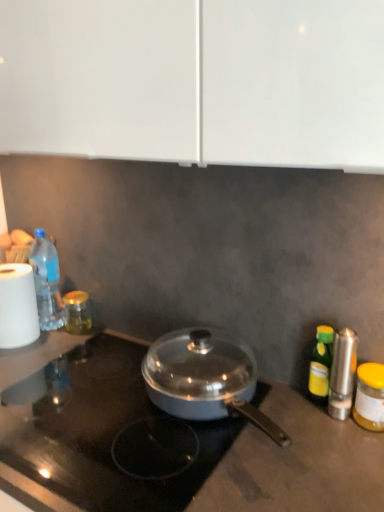
Question: Can you confirm if silver metallic salt shaker at right is taller than green glass bottle at right, which is the 2th bottle in front-to-back order?

Choices:
 (A) yes
 (B) no

Answer: (A)

Question: Is green glass bottle at right, the third bottle from the left, at the back of silver metallic salt shaker at right?

Choices:
 (A) no
 (B) yes

Answer: (A)

Question: Is silver metallic salt shaker at right aimed at green glass bottle at right, the 3th bottle positioned from the back?

Choices:
 (A) yes
 (B) no

Answer: (B)

Question: Is silver metallic salt shaker at right beside green glass bottle at right, marked as the second bottle in a right-to-left arrangement?

Choices:
 (A) yes
 (B) no

Answer: (A)

Question: Considering the relative positions of silver metallic salt shaker at right and green glass bottle at right, which is the 2th bottle in front-to-back order, in the image provided, is silver metallic salt shaker at right to the left of green glass bottle at right, which is the 2th bottle in front-to-back order, from the viewer's perspective?

Choices:
 (A) no
 (B) yes

Answer: (A)

Question: Does silver metallic salt shaker at right have a greater width compared to green glass bottle at right, the 3th bottle positioned from the back?

Choices:
 (A) no
 (B) yes

Answer: (B)

Question: From a real-world perspective, does silver metallic salt shaker at right stand above metallic gray pan at center?

Choices:
 (A) no
 (B) yes

Answer: (B)

Question: Is silver metallic salt shaker at right bigger than metallic gray pan at center?

Choices:
 (A) yes
 (B) no

Answer: (B)

Question: Considering the relative sizes of silver metallic salt shaker at right and metallic gray pan at center in the image provided, is silver metallic salt shaker at right thinner than metallic gray pan at center?

Choices:
 (A) yes
 (B) no

Answer: (A)

Question: Considering the relative positions of silver metallic salt shaker at right and metallic gray pan at center in the image provided, is silver metallic salt shaker at right to the right of metallic gray pan at center from the viewer's perspective?

Choices:
 (A) no
 (B) yes

Answer: (B)

Question: Is silver metallic salt shaker at right to the left of metallic gray pan at center from the viewer's perspective?

Choices:
 (A) yes
 (B) no

Answer: (B)

Question: Would you say silver metallic salt shaker at right contains metallic gray pan at center?

Choices:
 (A) no
 (B) yes

Answer: (A)

Question: Is green glass bottle at right, the 3th bottle positioned from the back, positioned with its back to white matte paper towel at left?

Choices:
 (A) yes
 (B) no

Answer: (B)